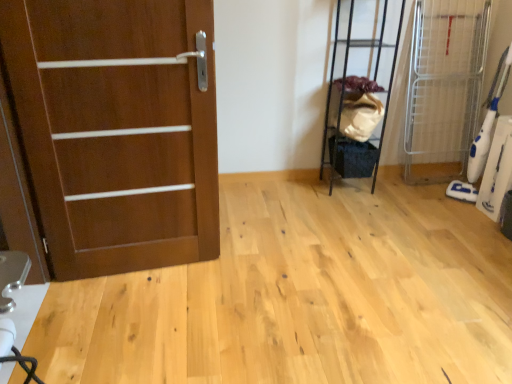
The image size is (512, 384). In order to click on free spot in front of matte wood door at left in this screenshot , I will do `click(131, 322)`.